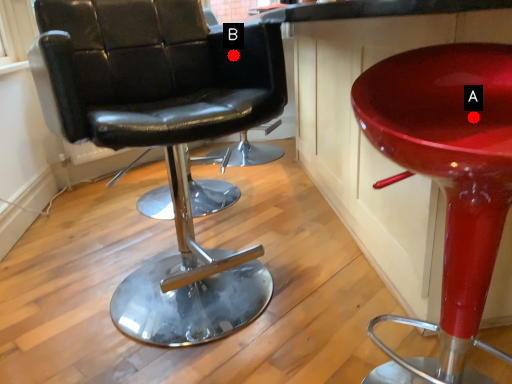
Question: Two points are circled on the image, labeled by A and B beside each circle. Which point is farther to the camera?

Choices:
 (A) A is further
 (B) B is further

Answer: (B)